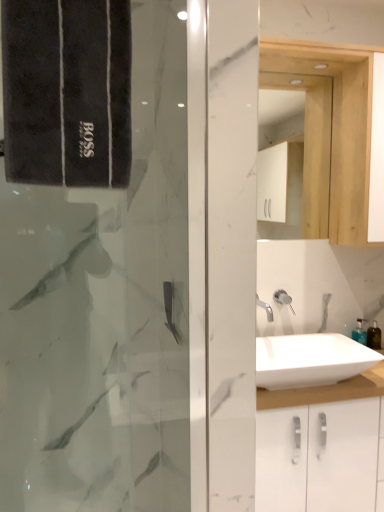
Locate an element on the screen. black velvet towel at left is located at coordinates (67, 92).

Measure the distance between white wood medicine cabinet at upper right and camera.

The distance of white wood medicine cabinet at upper right from camera is 6.04 feet.

You are a GUI agent. You are given a task and a screenshot of the screen. Output one action in this format:
    pyautogui.click(x=<x>, y=<y>)
    Task: Click on the white wood medicine cabinet at upper right
    
    Given the screenshot: What is the action you would take?
    pyautogui.click(x=312, y=147)

Describe the element at coordinates (310, 360) in the screenshot. I see `white glossy sink at center` at that location.

Looking at this image, measure the distance between translucent plastic soap dispenser at lower right and camera.

1.79 meters.

The image size is (384, 512). In order to click on white glossy shower at center in this screenshot , I will do click(x=283, y=298).

At what (x,y) coordinates should I click in order to perform the action: click on black velvet towel at left. Please return your answer as a coordinate pair (x, y). This screenshot has height=512, width=384. Looking at the image, I should click on (67, 92).

From the image's perspective, relative to white glossy sink at center, is white wood medicine cabinet at upper right above or below?

From the image's perspective, white wood medicine cabinet at upper right appears above white glossy sink at center.

In the scene shown: Is white wood medicine cabinet at upper right facing towards white glossy sink at center?

No, white wood medicine cabinet at upper right does not turn towards white glossy sink at center.

Image resolution: width=384 pixels, height=512 pixels. In order to click on medicine cabinet that is behind the white glossy sink at center in this screenshot , I will do `click(312, 147)`.

Can you confirm if white wood medicine cabinet at upper right is wider than white glossy sink at center?

Incorrect, the width of white wood medicine cabinet at upper right does not surpass that of white glossy sink at center.

Is white glossy shower at center in front of or behind white wood medicine cabinet at upper right in the image?

Clearly, white glossy shower at center is behind white wood medicine cabinet at upper right.

Is white glossy shower at center at the right side of white wood medicine cabinet at upper right?

Incorrect, white glossy shower at center is not on the right side of white wood medicine cabinet at upper right.

Is white glossy shower at center not inside white wood medicine cabinet at upper right?

That's correct, white glossy shower at center is outside of white wood medicine cabinet at upper right.

From the image's perspective, is white glossy shower at center over white wood medicine cabinet at upper right?

No, from the image's perspective, white glossy shower at center is not above white wood medicine cabinet at upper right.

Considering the relative sizes of white glossy sink at center and white glossy shower at center in the image provided, is white glossy sink at center smaller than white glossy shower at center?

No, white glossy sink at center is not smaller than white glossy shower at center.

Where is `shower above the white glossy sink at center (from the image's perspective)`? This screenshot has width=384, height=512. shower above the white glossy sink at center (from the image's perspective) is located at coordinates [x=283, y=298].

Is point (274, 339) farther from camera compared to point (280, 289)?

No.

Is white glossy shower at center inside white glossy sink at center?

No, white glossy shower at center is not a part of white glossy sink at center.

Where is `medicine cabinet on the left side of translucent plastic soap dispenser at lower right`? This screenshot has width=384, height=512. medicine cabinet on the left side of translucent plastic soap dispenser at lower right is located at coordinates (312, 147).

How different are the orientations of white wood medicine cabinet at upper right and translucent plastic soap dispenser at lower right in degrees?

white wood medicine cabinet at upper right and translucent plastic soap dispenser at lower right are facing 1.88 degrees away from each other.

From a real-world perspective, is white wood medicine cabinet at upper right physically located above or below translucent plastic soap dispenser at lower right?

Clearly, from a real-world perspective, white wood medicine cabinet at upper right is above translucent plastic soap dispenser at lower right.

Is the depth of white wood medicine cabinet at upper right greater than that of translucent plastic soap dispenser at lower right?

No, white wood medicine cabinet at upper right is in front of translucent plastic soap dispenser at lower right.

Based on the photo, can you see translucent plastic soap dispenser at lower right touching white glossy sink at center?

No.

In the scene shown: Could you tell me if translucent plastic soap dispenser at lower right is facing white glossy sink at center?

No, translucent plastic soap dispenser at lower right is not facing towards white glossy sink at center.

From a real-world perspective, between translucent plastic soap dispenser at lower right and white glossy sink at center, who is vertically higher?

translucent plastic soap dispenser at lower right, from a real-world perspective.

Could white glossy sink at center be considered to be inside translucent plastic soap dispenser at lower right?

No, white glossy sink at center is located outside of translucent plastic soap dispenser at lower right.

Based on their positions, is translucent plastic soap dispenser at lower right located to the left or right of black velvet towel at left?

Based on their positions, translucent plastic soap dispenser at lower right is located to the right of black velvet towel at left.

From a real-world perspective, is translucent plastic soap dispenser at lower right positioned over black velvet towel at left based on gravity?

No, from a real-world perspective, translucent plastic soap dispenser at lower right is not above black velvet towel at left.

You are a GUI agent. You are given a task and a screenshot of the screen. Output one action in this format:
    pyautogui.click(x=<x>, y=<y>)
    Task: Click on the toiletry below the black velvet towel at left (from the image's perspective)
    Image resolution: width=384 pixels, height=512 pixels.
    Given the screenshot: What is the action you would take?
    pyautogui.click(x=374, y=336)

Is translucent plastic soap dispenser at lower right next to black velvet towel at left?

No.

From the image's perspective, is white glossy shower at center above or below black velvet towel at left?

Based on their image positions, white glossy shower at center is located beneath black velvet towel at left.

Considering the positions of point (280, 295) and point (127, 2), is point (280, 295) closer or farther from the camera than point (127, 2)?

Point (280, 295) appears to be farther away from the viewer than point (127, 2).

Who is taller, white glossy shower at center or black velvet towel at left?

Standing taller between the two is black velvet towel at left.

In terms of width, does white glossy shower at center look wider or thinner when compared to black velvet towel at left?

white glossy shower at center is thinner than black velvet towel at left.

The width and height of the screenshot is (384, 512). Identify the location of sink in front of the white wood medicine cabinet at upper right. (310, 360).

Where is `shower lying behind the white wood medicine cabinet at upper right`? The height and width of the screenshot is (512, 384). shower lying behind the white wood medicine cabinet at upper right is located at coordinates (283, 298).

From the image, which object appears to be farther from white glossy sink at center, translucent plastic soap dispenser at lower right or black velvet towel at left?

Based on the image, black velvet towel at left appears to be further to white glossy sink at center.

When comparing their distances from translucent plastic soap dispenser at lower right, does black velvet towel at left or white glossy sink at center seem further?

black velvet towel at left lies further to translucent plastic soap dispenser at lower right than the other object.

Based on their spatial positions, is white glossy shower at center or white wood medicine cabinet at upper right closer to translucent plastic soap dispenser at lower right?

Based on the image, white glossy shower at center appears to be nearer to translucent plastic soap dispenser at lower right.

From the image, which object appears to be farther from white glossy shower at center, white wood medicine cabinet at upper right or translucent plastic soap dispenser at lower right?

Based on the image, white wood medicine cabinet at upper right appears to be further to white glossy shower at center.

Considering their positions, is white glossy sink at center positioned closer to white wood medicine cabinet at upper right than translucent plastic soap dispenser at lower right?

The object closer to white wood medicine cabinet at upper right is white glossy sink at center.

Based on their spatial positions, is white glossy shower at center or translucent plastic soap dispenser at lower right closer to black velvet towel at left?

white glossy shower at center.

Looking at the image, which one is located further to white glossy shower at center, translucent plastic soap dispenser at lower right or white wood medicine cabinet at upper right?

Among the two, white wood medicine cabinet at upper right is located further to white glossy shower at center.

From the image, which object appears to be nearer to white glossy sink at center, white wood medicine cabinet at upper right or black velvet towel at left?

white wood medicine cabinet at upper right is closer to white glossy sink at center.

Where is `sink located between black velvet towel at left and white wood medicine cabinet at upper right in the depth direction`? The image size is (384, 512). sink located between black velvet towel at left and white wood medicine cabinet at upper right in the depth direction is located at coordinates (310, 360).

This screenshot has height=512, width=384. What are the coordinates of `shower between white wood medicine cabinet at upper right and white glossy sink at center from top to bottom` in the screenshot? It's located at (283, 298).

Find the location of `sink located between black velvet towel at left and white glossy shower at center in the depth direction`. sink located between black velvet towel at left and white glossy shower at center in the depth direction is located at coordinates (310, 360).

Image resolution: width=384 pixels, height=512 pixels. What are the coordinates of `shower located between black velvet towel at left and translucent plastic soap dispenser at lower right in the depth direction` in the screenshot? It's located at (283, 298).